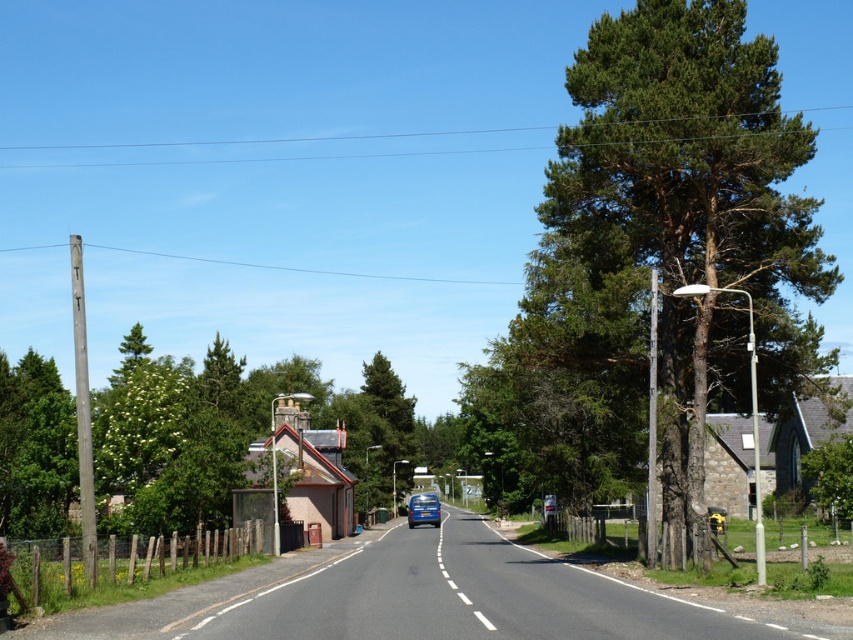
In the scene shown: Between green textured tree at right and green textured tree at center, which one is positioned higher?

green textured tree at right is higher up.

Is point (605, 282) farther from viewer compared to point (407, 476)?

No, (605, 282) is closer to viewer.

Identify the location of green textured tree at right. The width and height of the screenshot is (853, 640). (665, 241).

Is point (28, 378) closer to viewer compared to point (393, 404)?

Yes, it is.

The image size is (853, 640). Describe the element at coordinates (33, 448) in the screenshot. I see `green leafy tree at left` at that location.

The width and height of the screenshot is (853, 640). What do you see at coordinates (33, 448) in the screenshot?
I see `green leafy tree at left` at bounding box center [33, 448].

Image resolution: width=853 pixels, height=640 pixels. Identify the location of green leafy tree at left. (33, 448).

Who is taller, green textured tree at right or green leafy tree at left?

With more height is green textured tree at right.

Image resolution: width=853 pixels, height=640 pixels. Identify the location of green textured tree at right. (665, 241).